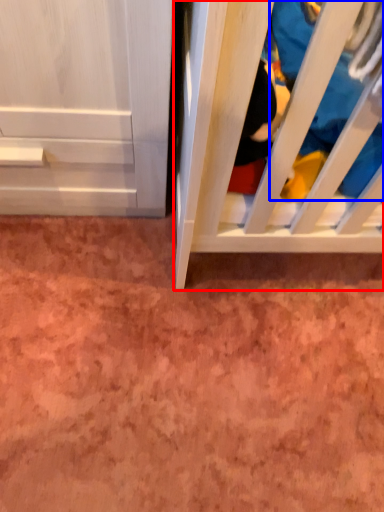
Question: Which object is further to the camera taking this photo, furniture (highlighted by a red box) or clothing (highlighted by a blue box)?

Choices:
 (A) furniture
 (B) clothing

Answer: (B)